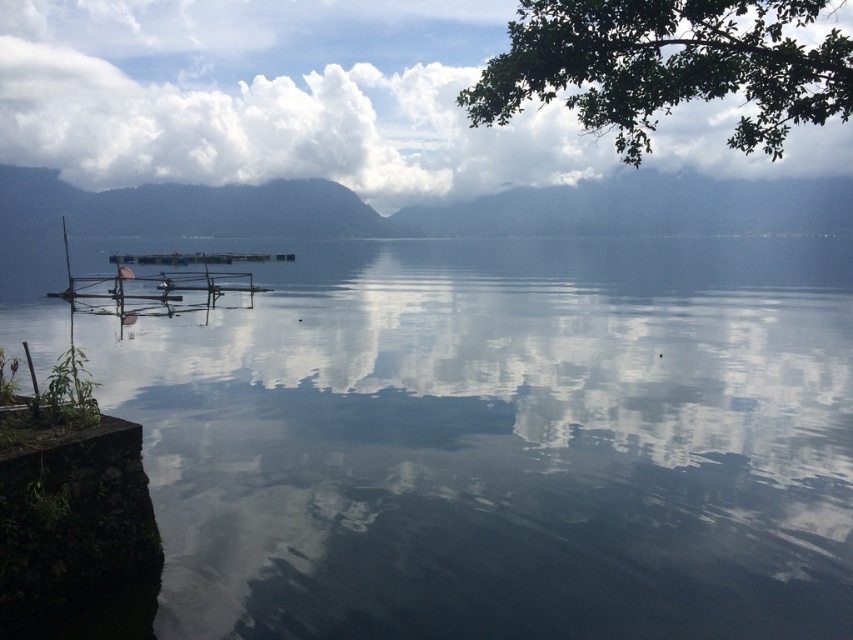
Does point (711, 365) come behind point (175, 298)?

No, it is in front of (175, 298).

What do you see at coordinates (498, 444) in the screenshot? The width and height of the screenshot is (853, 640). I see `transparent water at center` at bounding box center [498, 444].

Is point (428, 467) positioned in front of point (91, 285)?

Yes, point (428, 467) is closer to viewer.

Find the location of a particular element. transparent water at center is located at coordinates (498, 444).

Can you confirm if transparent water at center is positioned to the right of green leafy branch at upper right?

No, transparent water at center is not to the right of green leafy branch at upper right.

Which is more to the right, transparent water at center or green leafy branch at upper right?

Positioned to the right is green leafy branch at upper right.

Image resolution: width=853 pixels, height=640 pixels. Describe the element at coordinates (498, 444) in the screenshot. I see `transparent water at center` at that location.

Find the location of a particular element. The image size is (853, 640). transparent water at center is located at coordinates (498, 444).

Is wooden dock at center thinner than wooden raft at center?

Incorrect, wooden dock at center's width is not less than wooden raft at center's.

Does wooden dock at center have a smaller size compared to wooden raft at center?

Actually, wooden dock at center might be larger than wooden raft at center.

Locate an element on the screen. wooden dock at center is located at coordinates (160, 280).